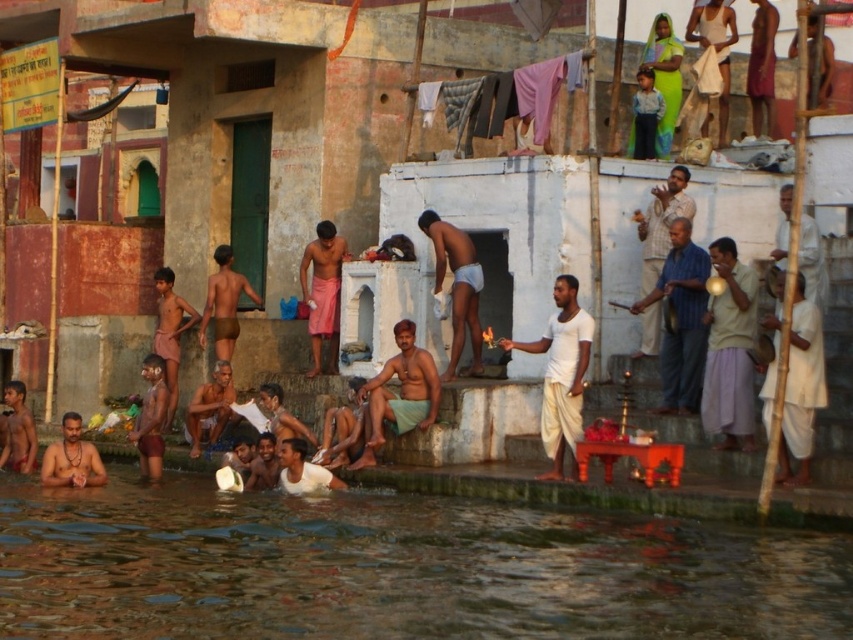
Based on the photo, you are a photographer trying to capture the striped cotton shirt at right and the green cotton cloth at center in the same frame. Which object should you focus on first to ensure both are in focus?

You should focus on the striped cotton shirt at right first because it is closer to the viewer than the green cotton cloth at center, so focusing on the closer object will help both be in focus.

You are a photographer trying to capture the scene with a wide angle lens. You want to ensure both the striped cotton shirt at right and the green cotton cloth at center are visible in the frame. Given their sizes, which object will appear smaller in the photo?

The striped cotton shirt at right will appear smaller in the photo because its width is less than the green cotton cloth at center.

You are a photographer standing at the edge of the water. You want to take a photo of the brown skin man at lower center without the brown water at lower left blocking him. Can you adjust your position to achieve this?

The brown water at lower left is in front of the brown skin man at lower center, so moving your position to the right or left might allow you to angle your camera to avoid the water blocking him.